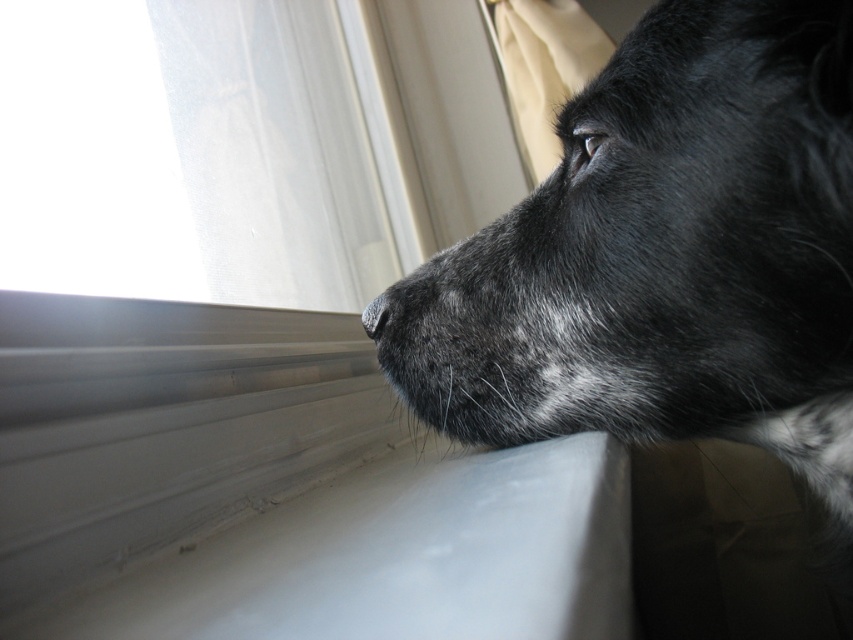
Can you confirm if transparent fabric at upper left is bigger than black matte nose at center?

Correct, transparent fabric at upper left is larger in size than black matte nose at center.

Who is positioned more to the left, transparent fabric at upper left or black matte nose at center?

transparent fabric at upper left is more to the left.

Is point (85, 42) behind point (398, 298)?

No, it is in front of (398, 298).

Image resolution: width=853 pixels, height=640 pixels. What are the coordinates of `transparent fabric at upper left` in the screenshot? It's located at (190, 154).

Consider the image. Is the position of black fur dog at upper right more distant than that of transparent fabric at upper left?

No, it is in front of transparent fabric at upper left.

Can you confirm if black fur dog at upper right is taller than transparent fabric at upper left?

No.

Measure the distance between black fur dog at upper right and camera.

A distance of 14.38 inches exists between black fur dog at upper right and camera.

The height and width of the screenshot is (640, 853). I want to click on black fur dog at upper right, so click(x=665, y=256).

Which is more to the left, black fur dog at upper right or black matte nose at center?

black matte nose at center is more to the left.

Who is taller, black fur dog at upper right or black matte nose at center?

Standing taller between the two is black fur dog at upper right.

Does point (744, 365) come behind point (386, 298)?

No.

The width and height of the screenshot is (853, 640). Find the location of `black fur dog at upper right`. black fur dog at upper right is located at coordinates (665, 256).